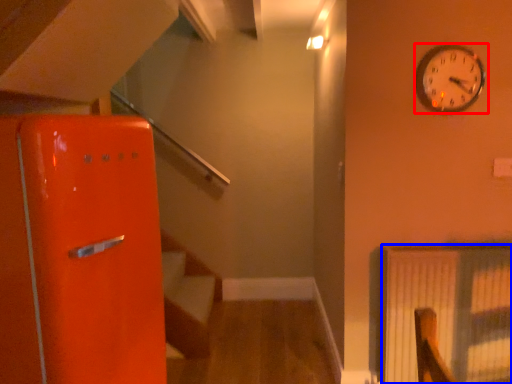
Question: Which object is further to the camera taking this photo, wall clock (highlighted by a red box) or radiator (highlighted by a blue box)?

Choices:
 (A) wall clock
 (B) radiator

Answer: (B)